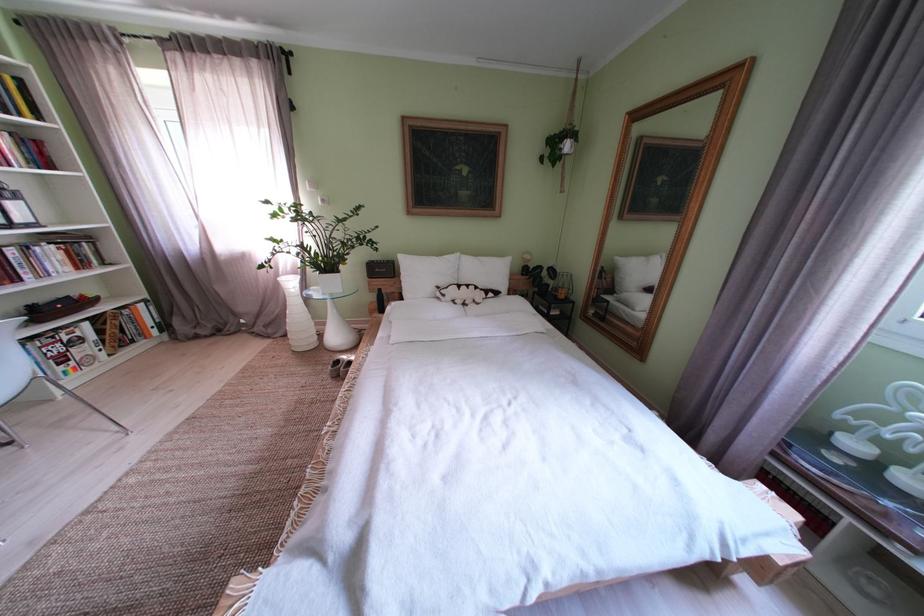
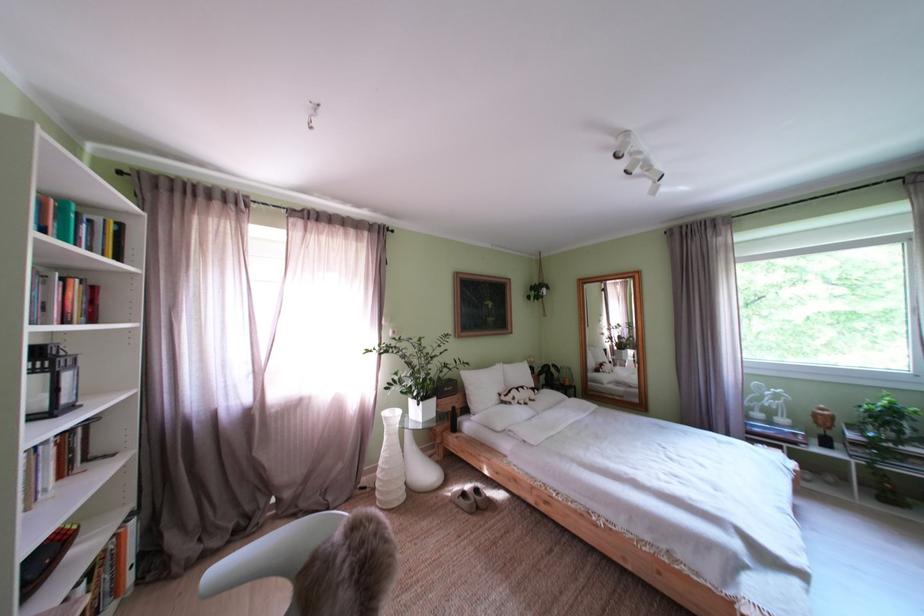
Find the pixel in the second image that matches (348,367) in the first image.

(475, 500)